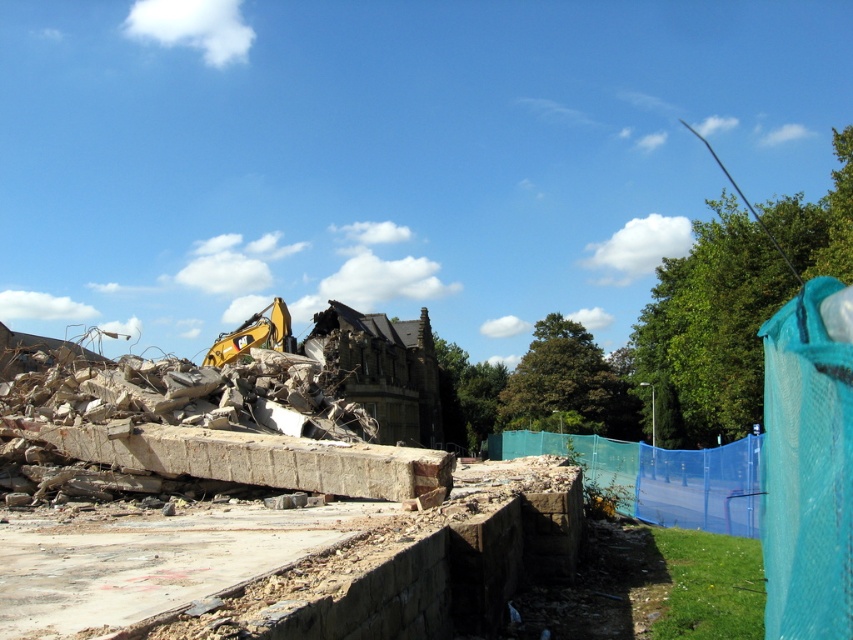
You are standing at the point labeled point [669,508] in a demolition site. You want to walk to the safety zone located at the edge of the site, which is 20 meters away from your current position. Will you be able to reach the safety zone without exceeding the 20 meters limit?

The distance between point [669,508] and the viewer is 18.40 meters. Since the safety zone is 20 meters away, you can reach it within the limit as 18.40 meters is less than 20 meters.

Based on the photo, you are a construction worker planning to move a 3m wide container through the space between the blue mesh fence at right and the yellow metallic excavator at upper left. Can the container fit through that space?

The blue mesh fence at right is narrower than the yellow metallic excavator at upper left, so the space between them may be sufficient for the container. However, without exact measurements of the distance between the two objects, it is impossible to confirm if the 3m wide container can fit through the space.

You are a construction worker planning to move the yellow metallic excavator at upper left closer to the blue mesh fence at right. Based on the scene, can you determine if the excavator will end up to the right of the fence after moving?

The blue mesh fence at right is already positioned on the right side of the yellow metallic excavator at upper left. Therefore, moving the excavator closer to the fence would place it to the left of the fence.